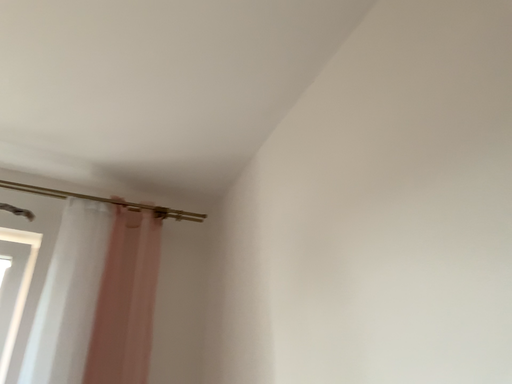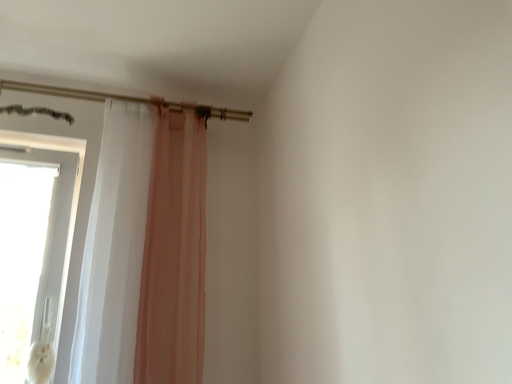
Question: How did the camera likely rotate when shooting the video?

Choices:
 (A) rotated right
 (B) rotated left

Answer: (B)